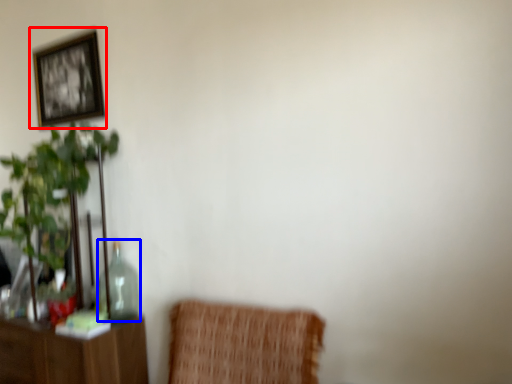
Question: Among these objects, which one is farthest to the camera, picture frame (highlighted by a red box) or glass vase (highlighted by a blue box)?

Choices:
 (A) picture frame
 (B) glass vase

Answer: (A)